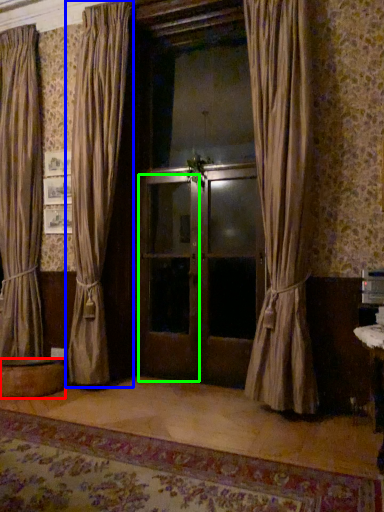
Question: Estimate the real-world distances between objects in this image. Which object is closer to round table (highlighted by a red box), curtain (highlighted by a blue box) or screen door (highlighted by a green box)?

Choices:
 (A) curtain
 (B) screen door

Answer: (A)